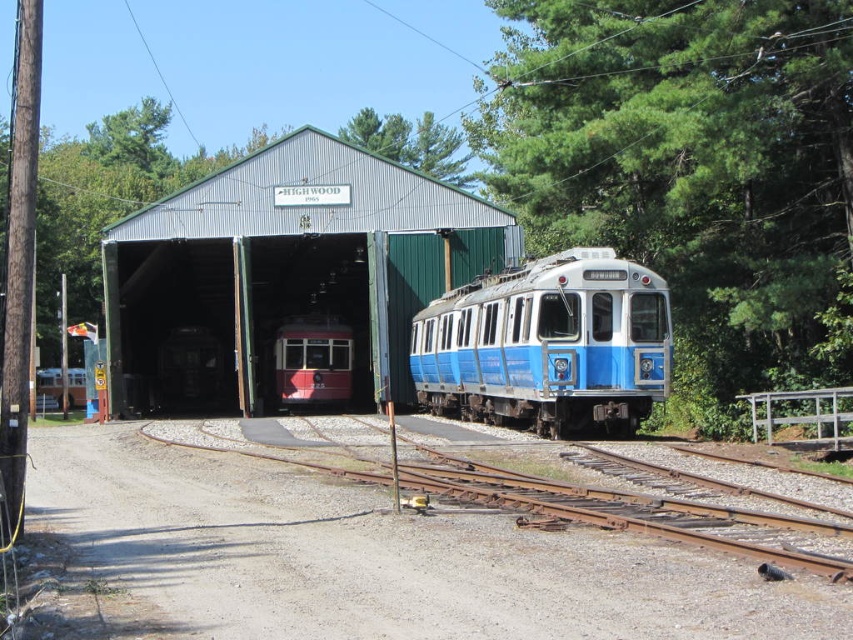
You are a railway worker who needs to transport a large equipment box that requires a flat, stable surface. Looking at the image, which area would be more suitable for placing the box between the dirt gravel at lower center and the matte red train at center?

The dirt gravel at lower center is bigger than the matte red train at center, so the dirt gravel at lower center would provide a more suitable and stable surface for placing the large equipment box.